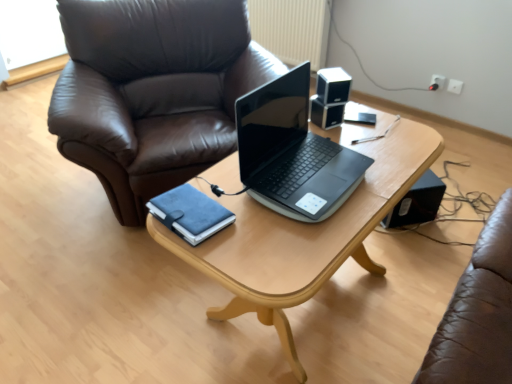
Question: Should I look upward or downward to see black plastic speaker at upper center, which ranks as the 2th speaker in bottom-to-top order?

Choices:
 (A) up
 (B) down

Answer: (A)

Question: From the image's perspective, is black glossy speaker at upper right, acting as the 2th speaker starting from the right, located beneath black plastic speaker at upper center, which ranks as the 2th speaker in bottom-to-top order?

Choices:
 (A) yes
 (B) no

Answer: (B)

Question: Does black glossy speaker at upper right, acting as the 2th speaker starting from the right, have a greater width compared to black plastic speaker at upper center, the 3th speaker in the right-to-left sequence?

Choices:
 (A) no
 (B) yes

Answer: (B)

Question: From a real-world perspective, is black glossy speaker at upper right, the first speaker viewed from the top, on black plastic speaker at upper center, which is the 1th speaker in left-to-right order?

Choices:
 (A) yes
 (B) no

Answer: (A)

Question: Could you tell me if black glossy speaker at upper right, which is counted as the 3th speaker, starting from the back, is facing black plastic speaker at upper center, which ranks as the 2th speaker in bottom-to-top order?

Choices:
 (A) no
 (B) yes

Answer: (A)

Question: Is black glossy speaker at upper right, the second speaker in the left-to-right sequence, with black plastic speaker at upper center, the 3th speaker in the right-to-left sequence?

Choices:
 (A) no
 (B) yes

Answer: (B)

Question: Does black glossy speaker at upper right, the second speaker in the left-to-right sequence, contain black plastic speaker at upper center, which appears as the 2th speaker when viewed from the front?

Choices:
 (A) yes
 (B) no

Answer: (B)

Question: Does black glossy speaker at upper right, positioned as the third speaker in bottom-to-top order, appear on the left side of white plastic electric outlet at upper right?

Choices:
 (A) no
 (B) yes

Answer: (B)

Question: Is black glossy speaker at upper right, the 1th speaker viewed from the front, at the right side of white plastic electric outlet at upper right?

Choices:
 (A) yes
 (B) no

Answer: (B)

Question: Is black glossy speaker at upper right, the second speaker in the left-to-right sequence, positioned with its back to white plastic electric outlet at upper right?

Choices:
 (A) yes
 (B) no

Answer: (B)

Question: Can we say black glossy speaker at upper right, the second speaker in the left-to-right sequence, lies outside white plastic electric outlet at upper right?

Choices:
 (A) no
 (B) yes

Answer: (B)

Question: Would you consider black glossy speaker at upper right, which is counted as the 3th speaker, starting from the back, to be distant from white plastic electric outlet at upper right?

Choices:
 (A) yes
 (B) no

Answer: (A)

Question: Does black glossy speaker at upper right, the second speaker in the left-to-right sequence, have a lesser height compared to white plastic electric outlet at upper right?

Choices:
 (A) yes
 (B) no

Answer: (B)

Question: Is black plastic speaker at lower right, placed as the third speaker when sorted from left to right, to the left of sleek black laptop at center from the viewer's perspective?

Choices:
 (A) no
 (B) yes

Answer: (A)